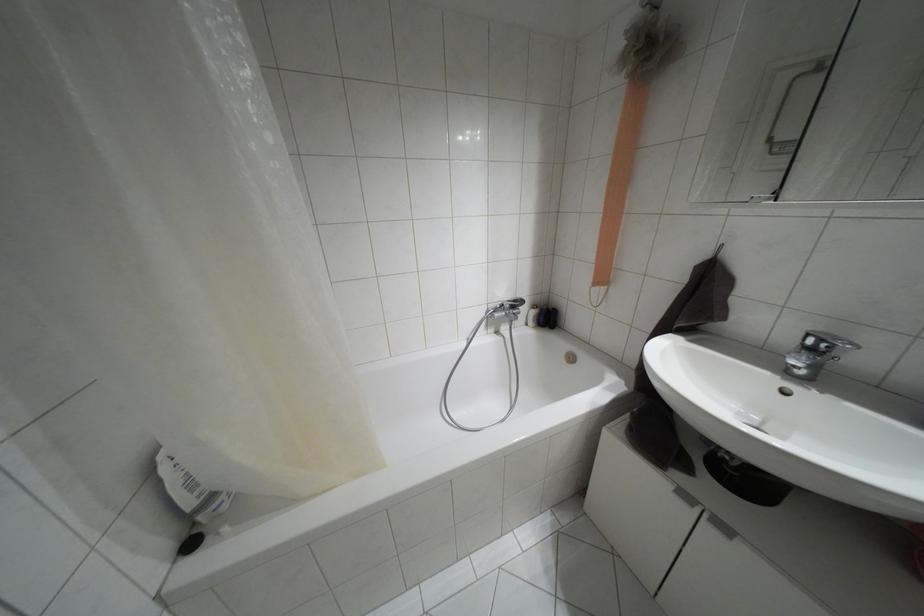
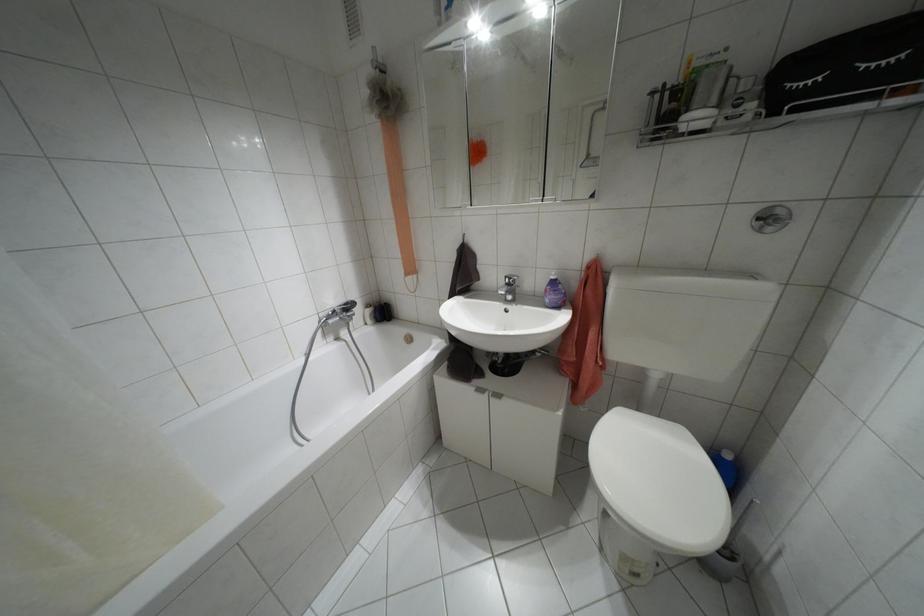
In the second image, find the point that corresponds to the point at 532,306 in the first image.

(367, 305)